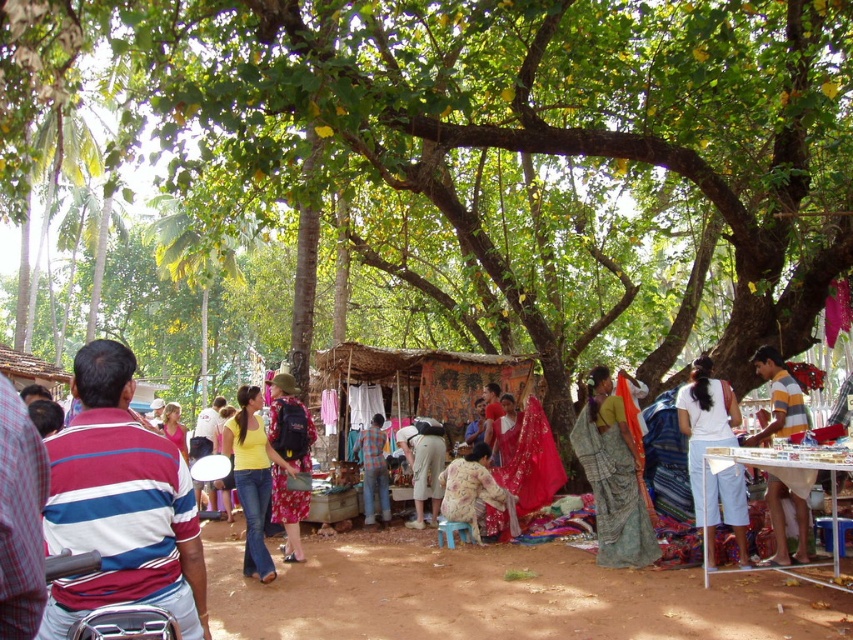
Who is positioned more to the right, white cotton shirt at center or floral dress at center?

From the viewer's perspective, white cotton shirt at center appears more on the right side.

Can you confirm if white cotton shirt at center is shorter than floral dress at center?

Correct, white cotton shirt at center is not as tall as floral dress at center.

Who is more distant from viewer, (x=732, y=509) or (x=287, y=429)?

Positioned behind is point (x=287, y=429).

Find the location of `white cotton shirt at center`. white cotton shirt at center is located at coordinates (704, 451).

Can you confirm if textile fabric stall at center is taller than striped cotton shirt at left?

No.

Can you confirm if textile fabric stall at center is bigger than striped cotton shirt at left?

Incorrect, textile fabric stall at center is not larger than striped cotton shirt at left.

Find the location of a particular element. textile fabric stall at center is located at coordinates (498, 595).

Identify the location of textile fabric stall at center. (498, 595).

Between striped cotton shirt at left and yellow cotton shirt at center, which one has less height?

Standing shorter between the two is striped cotton shirt at left.

The width and height of the screenshot is (853, 640). I want to click on striped cotton shirt at left, so click(x=120, y=504).